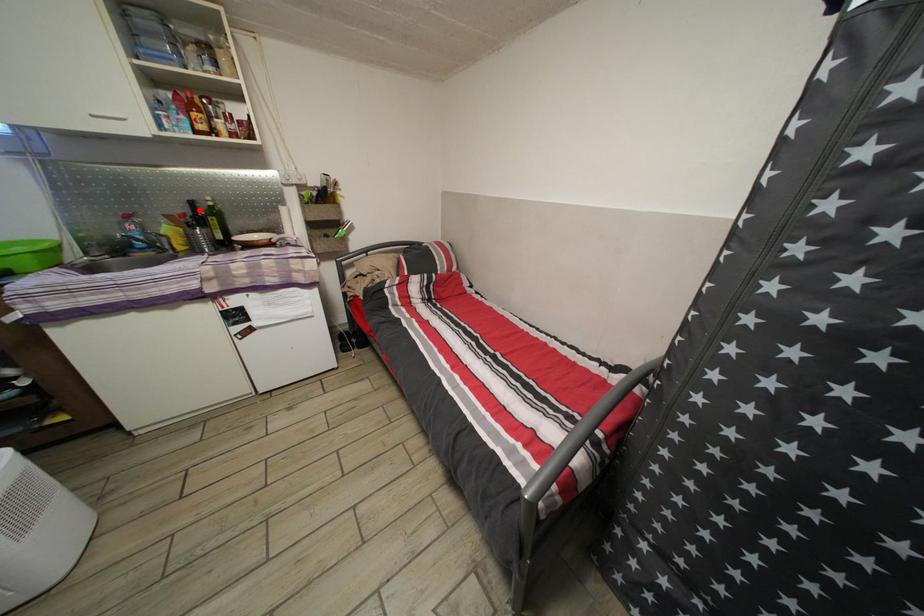
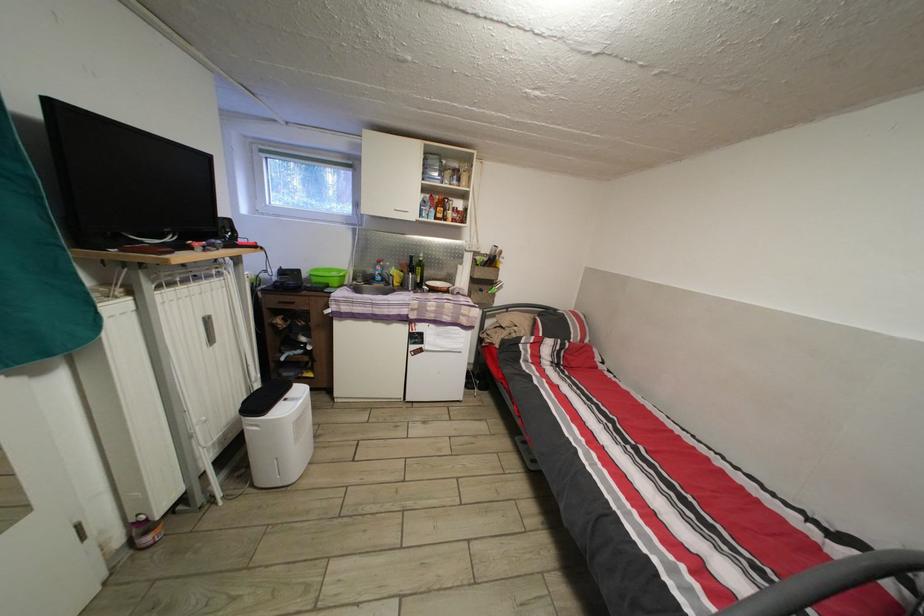
Locate, in the second image, the point that corresponds to the highlighted location in the first image.

(419, 265)